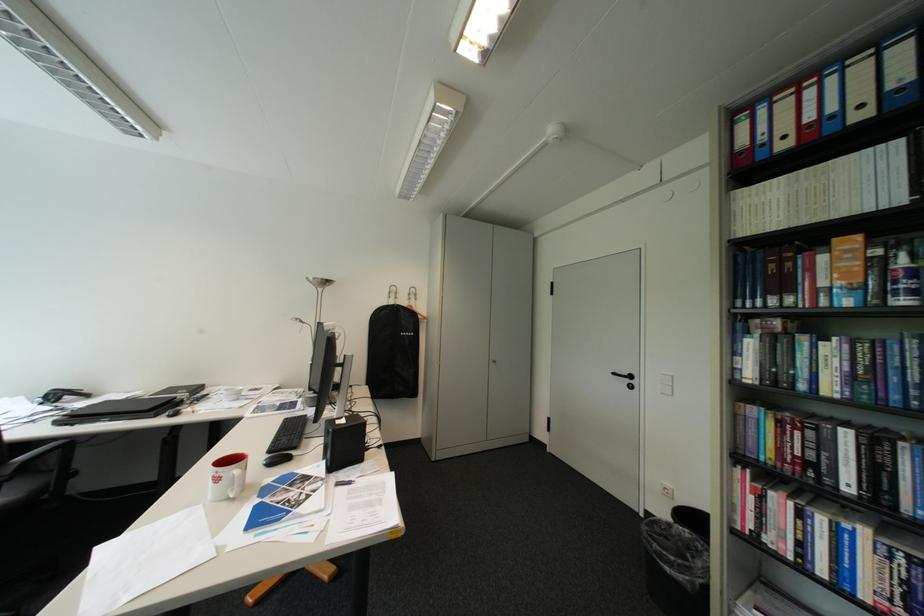
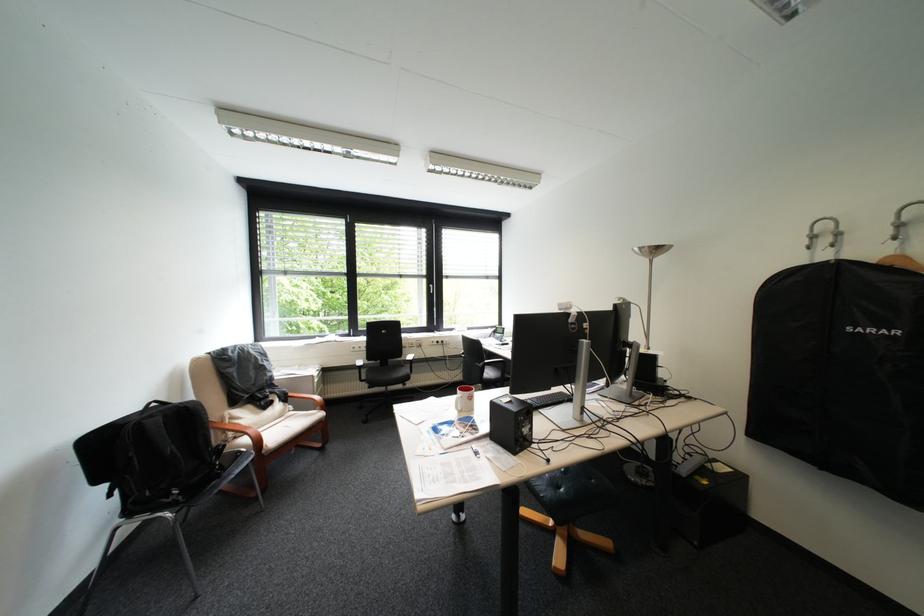
The point at (405, 296) is marked in the first image. Where is the corresponding point in the second image?

(837, 241)